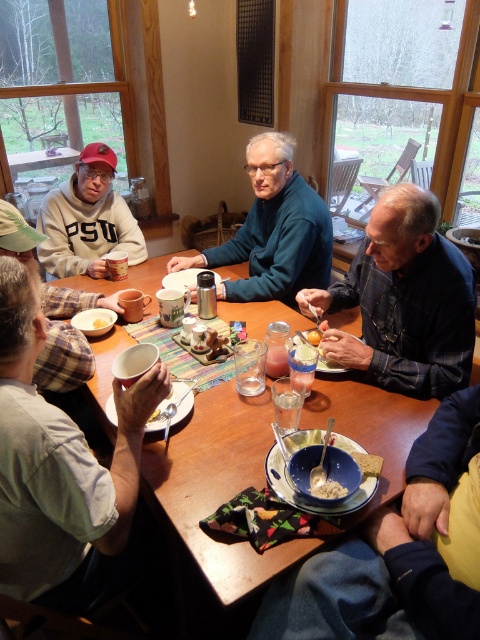
Question: Which point is closer to the camera taking this photo?

Choices:
 (A) (98, 324)
 (B) (100, 323)

Answer: (A)

Question: Which object is positioned farthest from the smooth brown bowl at lower center?

Choices:
 (A) matte blue bowl at center
 (B) matte white bowl at lower left
 (C) plaid fabric shirt at lower left

Answer: (B)

Question: Can you confirm if blue plaid shirt at right is positioned below matte gray sweatshirt at left?

Choices:
 (A) yes
 (B) no

Answer: (A)

Question: Can you confirm if matte white mug at lower left is wider than smooth brown bowl at lower center?

Choices:
 (A) no
 (B) yes

Answer: (B)

Question: Does matte gray sweatshirt at left come behind white matte bowl at center?

Choices:
 (A) no
 (B) yes

Answer: (B)

Question: Which point is closer to the camera taking this photo?

Choices:
 (A) (370, 467)
 (B) (103, 156)

Answer: (A)